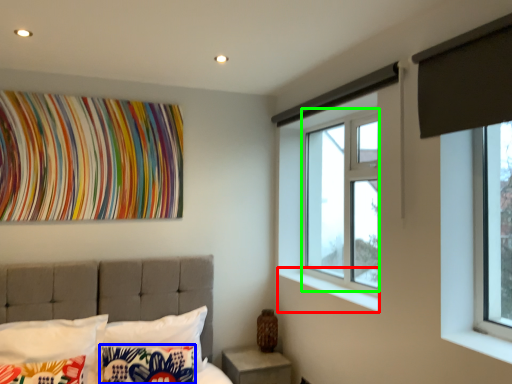
Question: Considering the real-world distances, which object is farthest from window sill (highlighted by a red box)? pillow (highlighted by a blue box) or bay window (highlighted by a green box)?

Choices:
 (A) pillow
 (B) bay window

Answer: (A)